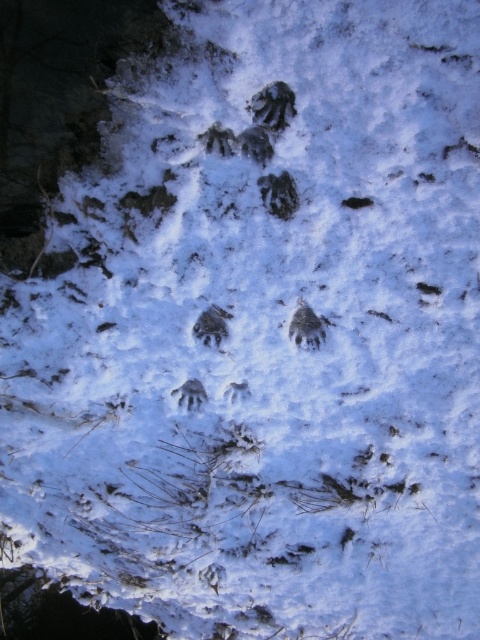
Question: Does brown fur at center have a larger size compared to dark fur paw print at center?

Choices:
 (A) no
 (B) yes

Answer: (B)

Question: Which point appears farthest from the camera in this image?

Choices:
 (A) (193, 330)
 (B) (309, 305)

Answer: (A)

Question: Can you confirm if brown fur at center is positioned to the left of dark fur paw print at center?

Choices:
 (A) no
 (B) yes

Answer: (A)

Question: Is brown fur at center to the right of dark fur paw print at center from the viewer's perspective?

Choices:
 (A) yes
 (B) no

Answer: (A)

Question: Which object appears closest to the camera in this image?

Choices:
 (A) dark fur paw print at center
 (B) brown fur at center

Answer: (B)

Question: Among these points, which one is nearest to the camera?

Choices:
 (A) (195, 324)
 (B) (310, 339)

Answer: (B)